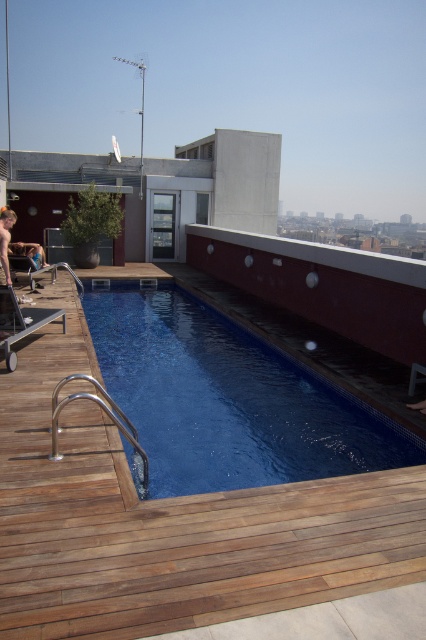
You are designing a new rooftop area and want to ensure there is enough space for both the wooden deck at center and the blue tile swimming pool at center. Based on the image, which one has a greater length?

The blue tile swimming pool at center has a greater length than the wooden deck at center, as the wooden deck at center is shorter than blue tile swimming pool at center.

You are standing at the entrance of the rooftop pool area and want to swim in the blue tile swimming pool at center. Which direction should you move towards to reach it?

The blue tile swimming pool at center is located at point (x=227, y=400), so you should move forward towards the center of the rooftop area to reach it.

You are a maintenance worker needing to place a 36 inch long ladder horizontally between the wooden deck at center and the silver metallic rail at lower left. Can you fit it there?

The distance between wooden deck at center and silver metallic rail at lower left is 32.22 inches. Since the ladder is 36 inches long, it is longer than the available space, so it won t fit.